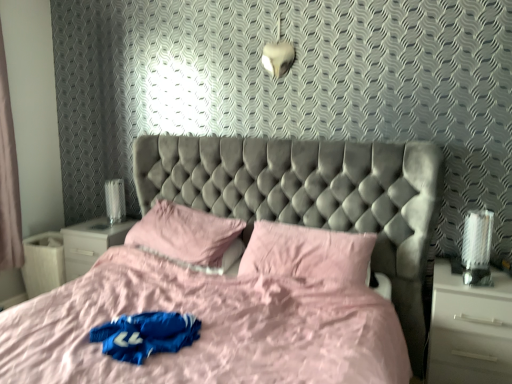
The width and height of the screenshot is (512, 384). I want to click on white glossy table lamp at left, so click(x=115, y=200).

In order to face pink fabric pillow at center, marked as the second pillow in a right-to-left arrangement, should I rotate leftwards or rightwards?

Turn left by 9.399 degrees to look at pink fabric pillow at center, marked as the second pillow in a right-to-left arrangement.

This screenshot has width=512, height=384. What do you see at coordinates (8, 178) in the screenshot?
I see `pink fabric curtain at left` at bounding box center [8, 178].

This screenshot has width=512, height=384. What do you see at coordinates (90, 243) in the screenshot?
I see `white glossy nightstand at lower left, positioned as the first nightstand in left-to-right order` at bounding box center [90, 243].

Locate an element on the screen. This screenshot has height=384, width=512. white glossy table lamp at left is located at coordinates (115, 200).

Considering the relative positions of pink fabric pillow at center, positioned as the 1th pillow in left-to-right order, and pink satin pillow at center, placed as the second pillow when sorted from left to right, in the image provided, is pink fabric pillow at center, positioned as the 1th pillow in left-to-right order, to the right of pink satin pillow at center, placed as the second pillow when sorted from left to right, from the viewer's perspective?

Incorrect, pink fabric pillow at center, positioned as the 1th pillow in left-to-right order, is not on the right side of pink satin pillow at center, placed as the second pillow when sorted from left to right.

Where is `pillow below the pink fabric pillow at center, positioned as the 1th pillow in left-to-right order (from the image's perspective)`? Image resolution: width=512 pixels, height=384 pixels. pillow below the pink fabric pillow at center, positioned as the 1th pillow in left-to-right order (from the image's perspective) is located at coordinates [308, 253].

Is pink fabric pillow at center, marked as the second pillow in a right-to-left arrangement, looking in the opposite direction of pink satin pillow at center, placed as the second pillow when sorted from left to right?

pink fabric pillow at center, marked as the second pillow in a right-to-left arrangement, is not turned away from pink satin pillow at center, placed as the second pillow when sorted from left to right.

From a real-world perspective, is pink fabric pillow at center, positioned as the 1th pillow in left-to-right order, over pink satin pillow at center, which appears as the 1th pillow when viewed from the right?

Yes, from a real-world perspective, pink fabric pillow at center, positioned as the 1th pillow in left-to-right order, is over pink satin pillow at center, which appears as the 1th pillow when viewed from the right

Which is nearer, (106, 224) or (283, 243)?

Point (106, 224).

Which object is positioned more to the left, white glossy nightstand at lower left, acting as the 2th nightstand starting from the front, or pink satin pillow at center, placed as the second pillow when sorted from left to right?

From the viewer's perspective, white glossy nightstand at lower left, acting as the 2th nightstand starting from the front, appears more on the left side.

Who is bigger, white glossy nightstand at lower left, positioned as the first nightstand in left-to-right order, or pink satin pillow at center, which appears as the 1th pillow when viewed from the right?

pink satin pillow at center, which appears as the 1th pillow when viewed from the right, is bigger.

From the image's perspective, who appears lower, white glossy nightstand at lower left, which is the 2th nightstand in right-to-left order, or pink satin pillow at center, which appears as the 1th pillow when viewed from the right?

white glossy nightstand at lower left, which is the 2th nightstand in right-to-left order, appears lower in the image.

Is white glossy nightstand at right, arranged as the 1th nightstand when viewed from the front, aimed at pink fabric pillow at center, marked as the second pillow in a right-to-left arrangement?

No, white glossy nightstand at right, arranged as the 1th nightstand when viewed from the front, is not oriented towards pink fabric pillow at center, marked as the second pillow in a right-to-left arrangement.

The height and width of the screenshot is (384, 512). I want to click on the 2nd nightstand positioned below the pink fabric pillow at center, positioned as the 1th pillow in left-to-right order (from a real-world perspective), so click(469, 329).

Can you confirm if white glossy nightstand at right, arranged as the 1th nightstand when viewed from the front, is shorter than pink fabric pillow at center, positioned as the 1th pillow in left-to-right order?

In fact, white glossy nightstand at right, arranged as the 1th nightstand when viewed from the front, may be taller than pink fabric pillow at center, positioned as the 1th pillow in left-to-right order.

From the image's perspective, which one is positioned lower, white glossy nightstand at right, arranged as the 1th nightstand when viewed from the front, or pink fabric pillow at center, positioned as the 1th pillow in left-to-right order?

white glossy nightstand at right, arranged as the 1th nightstand when viewed from the front, from the image's perspective.

Is point (119, 180) in front of point (265, 266)?

No, (119, 180) is further to viewer.

Identify the location of bed located below the white glossy table lamp at left (from the image's perspective). (253, 274).

Consider the image. Looking at the image, does white glossy table lamp at left seem bigger or smaller compared to velvet grey bed at center?

white glossy table lamp at left is smaller than velvet grey bed at center.

From the image's perspective, relative to velvet grey bed at center, is white glossy table lamp at left above or below?

white glossy table lamp at left is situated higher than velvet grey bed at center in the image.

I want to click on curtain above the velvet grey bed at center (from the image's perspective), so click(8, 178).

In the scene shown: Is pink fabric curtain at left bigger than velvet grey bed at center?

No, pink fabric curtain at left is not bigger than velvet grey bed at center.

Does pink fabric curtain at left have a greater width compared to velvet grey bed at center?

No.

From the image's perspective, is pink fabric curtain at left above velvet grey bed at center?

Yes, from the image's perspective, pink fabric curtain at left is above velvet grey bed at center.

Locate an element on the screen. bed below the white glossy table lamp at left (from the image's perspective) is located at coordinates (253, 274).

Considering the positions of objects velvet grey bed at center and white glossy table lamp at left in the image provided, who is behind, velvet grey bed at center or white glossy table lamp at left?

white glossy table lamp at left is behind.

What's the angular difference between velvet grey bed at center and white glossy table lamp at left's facing directions?

They differ by 2.02 degrees in their facing directions.

Based on the photo, looking at the image, does velvet grey bed at center seem bigger or smaller compared to white glossy table lamp at left?

Considering their sizes, velvet grey bed at center takes up more space than white glossy table lamp at left.

Could velvet grey bed at center be considered to be inside pink fabric pillow at center, positioned as the 1th pillow in left-to-right order?

No, velvet grey bed at center is not inside pink fabric pillow at center, positioned as the 1th pillow in left-to-right order.

Considering the sizes of objects pink fabric pillow at center, marked as the second pillow in a right-to-left arrangement, and velvet grey bed at center in the image provided, who is smaller, pink fabric pillow at center, marked as the second pillow in a right-to-left arrangement, or velvet grey bed at center?

pink fabric pillow at center, marked as the second pillow in a right-to-left arrangement.

Based on the photo, is pink fabric pillow at center, marked as the second pillow in a right-to-left arrangement, in front of velvet grey bed at center?

No, pink fabric pillow at center, marked as the second pillow in a right-to-left arrangement, is behind velvet grey bed at center.

What are the coordinates of `pillow that is on the left side of pink satin pillow at center, placed as the second pillow when sorted from left to right` in the screenshot? It's located at (187, 235).

From the image's perspective, starting from the pink satin pillow at center, placed as the second pillow when sorted from left to right, which nightstand is the 1st one below? Please provide its 2D coordinates.

[(90, 243)]

Considering their positions, is pink fabric curtain at left positioned closer to white glossy table lamp at left than velvet grey bed at center?

Among the two, pink fabric curtain at left is located nearer to white glossy table lamp at left.

From the picture: From the image, which object appears to be nearer to white glossy nightstand at lower left, which ranks as the first nightstand in back-to-front order, pink fabric curtain at left or white glossy nightstand at right, positioned as the second nightstand in left-to-right order?

pink fabric curtain at left lies closer to white glossy nightstand at lower left, which ranks as the first nightstand in back-to-front order, than the other object.

In the scene shown: When comparing their distances from velvet grey bed at center, does white glossy nightstand at right, arranged as the 1th nightstand when viewed from the front, or pink fabric curtain at left seem closer?

The object closer to velvet grey bed at center is white glossy nightstand at right, arranged as the 1th nightstand when viewed from the front.

Based on their spatial positions, is pink satin pillow at center, placed as the second pillow when sorted from left to right, or velvet grey bed at center closer to pink fabric pillow at center, marked as the second pillow in a right-to-left arrangement?

velvet grey bed at center.

Which object lies nearer to the anchor point pink fabric curtain at left, white glossy table lamp at left or white glossy nightstand at right, arranged as the 1th nightstand when viewed from the front?

white glossy table lamp at left is closer to pink fabric curtain at left.

Looking at the image, which one is located further to pink satin pillow at center, which appears as the 1th pillow when viewed from the right, white glossy table lamp at left or velvet grey bed at center?

white glossy table lamp at left lies further to pink satin pillow at center, which appears as the 1th pillow when viewed from the right, than the other object.

Considering their positions, is white glossy nightstand at lower left, acting as the 2th nightstand starting from the front, positioned further to pink fabric pillow at center, positioned as the 1th pillow in left-to-right order, than pink satin pillow at center, which appears as the 1th pillow when viewed from the right?

white glossy nightstand at lower left, acting as the 2th nightstand starting from the front.

When comparing their distances from pink fabric curtain at left, does pink fabric pillow at center, positioned as the 1th pillow in left-to-right order, or white glossy nightstand at right, arranged as the 1th nightstand when viewed from the front, seem closer?

The object closer to pink fabric curtain at left is pink fabric pillow at center, positioned as the 1th pillow in left-to-right order.

In order to click on pillow between pink fabric pillow at center, marked as the second pillow in a right-to-left arrangement, and white glossy nightstand at right, positioned as the second nightstand in left-to-right order, in the horizontal direction in this screenshot , I will do `click(308, 253)`.

Image resolution: width=512 pixels, height=384 pixels. Identify the location of pillow between white glossy table lamp at left and pink satin pillow at center, which appears as the 1th pillow when viewed from the right, from left to right. (187, 235).

This screenshot has height=384, width=512. In order to click on pillow located between white glossy nightstand at lower left, which ranks as the first nightstand in back-to-front order, and pink satin pillow at center, placed as the second pillow when sorted from left to right, in the left-right direction in this screenshot , I will do `click(187, 235)`.

The width and height of the screenshot is (512, 384). Identify the location of nightstand between velvet grey bed at center and pink satin pillow at center, placed as the second pillow when sorted from left to right, in the front-back direction. (469, 329).